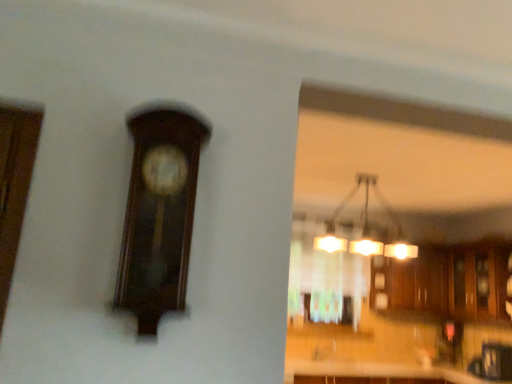
Question: From the image's perspective, is wooden cabinets at center beneath dark wood clock at upper left?

Choices:
 (A) no
 (B) yes

Answer: (B)

Question: Can you confirm if wooden cabinets at center is wider than dark wood clock at upper left?

Choices:
 (A) no
 (B) yes

Answer: (B)

Question: Can you confirm if wooden cabinets at center is smaller than dark wood clock at upper left?

Choices:
 (A) no
 (B) yes

Answer: (A)

Question: Would you consider wooden cabinets at center to be distant from dark wood clock at upper left?

Choices:
 (A) yes
 (B) no

Answer: (A)

Question: Does wooden cabinets at center appear on the left side of dark wood clock at upper left?

Choices:
 (A) yes
 (B) no

Answer: (B)

Question: From a real-world perspective, is wooden cabinets at center physically located above or below translucent glass window at center?

Choices:
 (A) above
 (B) below

Answer: (B)

Question: Considering the positions of point pyautogui.click(x=399, y=307) and point pyautogui.click(x=331, y=281), is point pyautogui.click(x=399, y=307) closer or farther from the camera than point pyautogui.click(x=331, y=281)?

Choices:
 (A) farther
 (B) closer

Answer: (A)

Question: Do you think wooden cabinets at center is within translucent glass window at center, or outside of it?

Choices:
 (A) inside
 (B) outside

Answer: (B)

Question: Is wooden cabinets at center wider or thinner than translucent glass window at center?

Choices:
 (A) thin
 (B) wide

Answer: (B)

Question: Is point (294, 266) closer or farther from the camera than point (401, 286)?

Choices:
 (A) farther
 (B) closer

Answer: (B)

Question: From their relative heights in the image, would you say translucent glass window at center is taller or shorter than wooden cabinets at center?

Choices:
 (A) tall
 (B) short

Answer: (B)

Question: Considering the relative positions of translucent glass window at center and wooden cabinets at center in the image provided, is translucent glass window at center to the left or to the right of wooden cabinets at center?

Choices:
 (A) right
 (B) left

Answer: (B)

Question: From a real-world perspective, is translucent glass window at center physically located above or below wooden cabinets at center?

Choices:
 (A) below
 (B) above

Answer: (B)

Question: From their relative heights in the image, would you say matte glass chandelier at upper center is taller or shorter than translucent glass window at center?

Choices:
 (A) short
 (B) tall

Answer: (A)

Question: Is point (327, 230) positioned closer to the camera than point (292, 223)?

Choices:
 (A) farther
 (B) closer

Answer: (A)